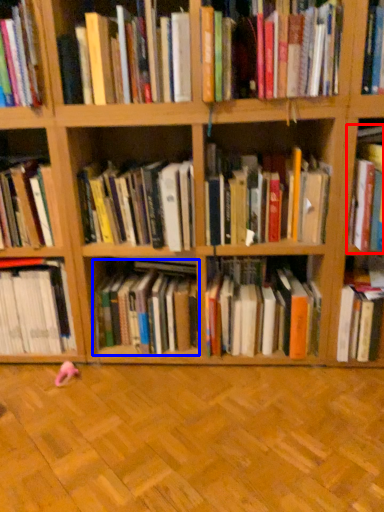
Question: Which point is further to the camera, book (highlighted by a red box) or book (highlighted by a blue box)?

Choices:
 (A) book
 (B) book

Answer: (B)